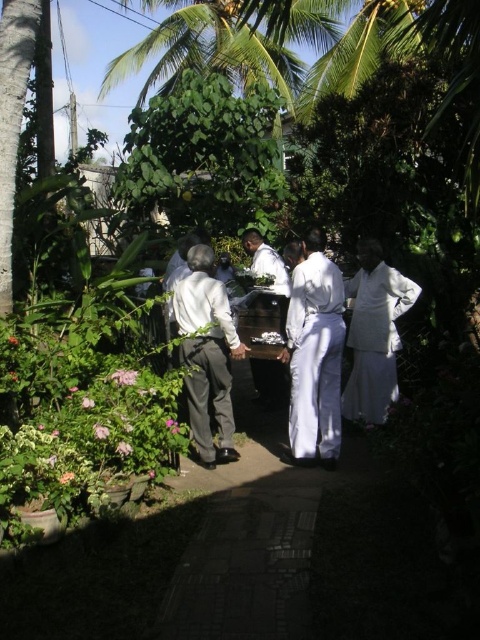
Based on the photo, you are standing at the point marked by the coordinates point (206, 358). Looking around, you see a white matte shirt at center. Which direction should you move to avoid stepping on the white matte shirt at center?

Since the point (206, 358) represents the location of the white matte shirt at center, you should move away from that point in any direction to avoid stepping on it.

In the scene shown: You are a photographer trying to capture the scene of the group carrying the coffin. You notice two white garments at the center of the image. Which garment appears thinner between the white cotton robe at center and the white matte shirt at center?

The white cotton robe at center is thinner than the white matte shirt at center, so the white cotton robe at center appears thinner.